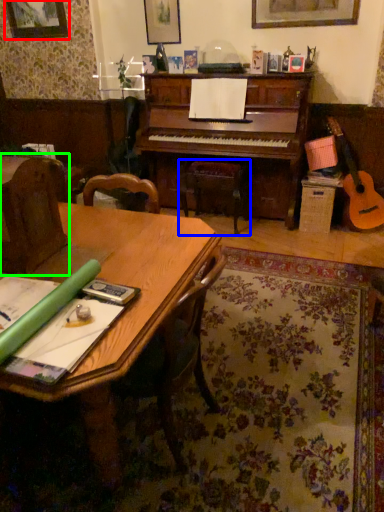
Question: Based on their relative distances, which object is farther from picture frame (highlighted by a red box)? Choose from music stool (highlighted by a blue box) and armchair (highlighted by a green box).

Choices:
 (A) music stool
 (B) armchair

Answer: (B)